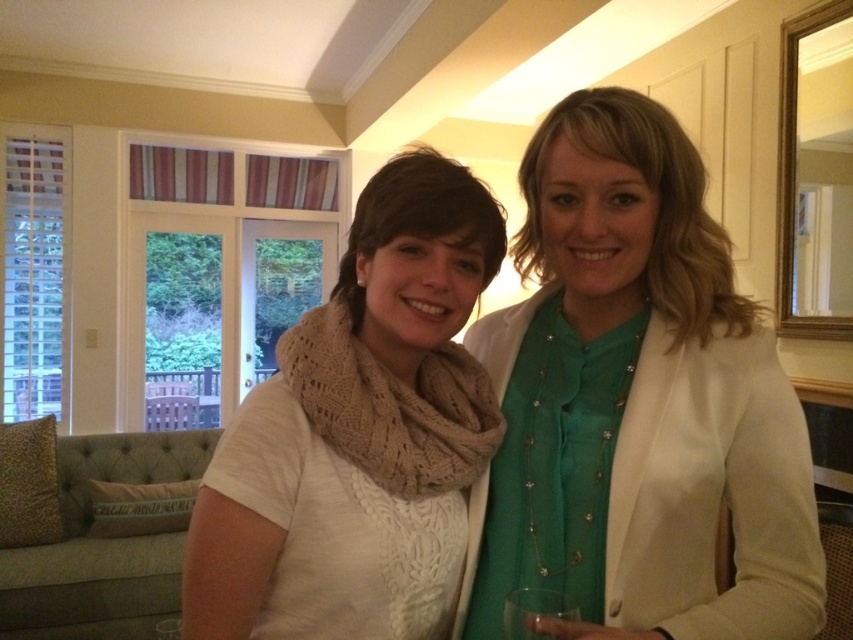
Question: Does matte white blazer at center have a lesser width compared to white knit scarf at center?

Choices:
 (A) no
 (B) yes

Answer: (A)

Question: Estimate the real-world distances between objects in this image. Which object is farther from the white knit scarf at center?

Choices:
 (A) matte white blazer at center
 (B) knit beige scarf at center

Answer: (A)

Question: Is matte white blazer at center to the right of white knit scarf at center from the viewer's perspective?

Choices:
 (A) no
 (B) yes

Answer: (B)

Question: Is matte white blazer at center above knit beige scarf at center?

Choices:
 (A) no
 (B) yes

Answer: (B)

Question: Which of these objects is positioned closest to the white knit scarf at center?

Choices:
 (A) matte white blazer at center
 (B) knit beige scarf at center

Answer: (B)

Question: Among these objects, which one is nearest to the camera?

Choices:
 (A) matte white blazer at center
 (B) knit beige scarf at center

Answer: (A)